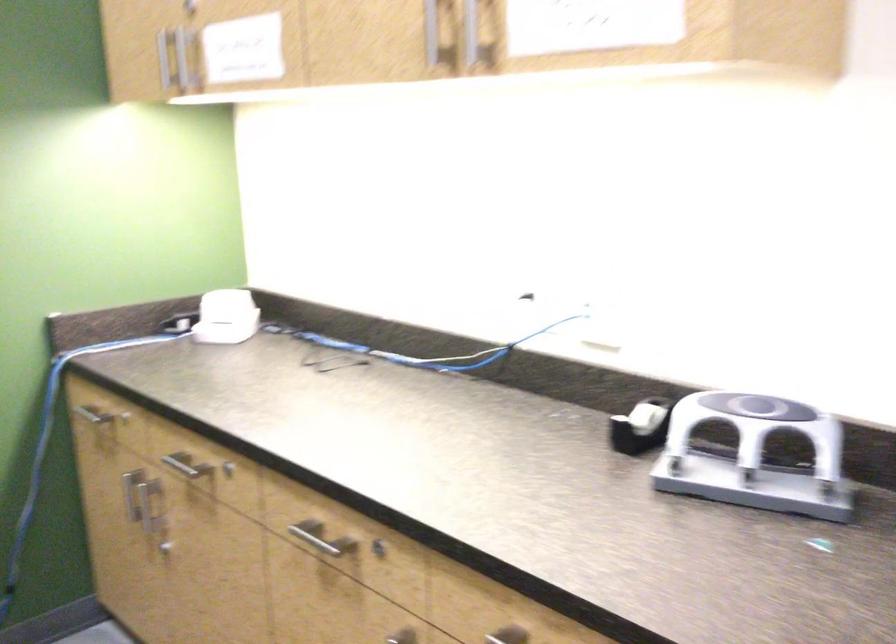
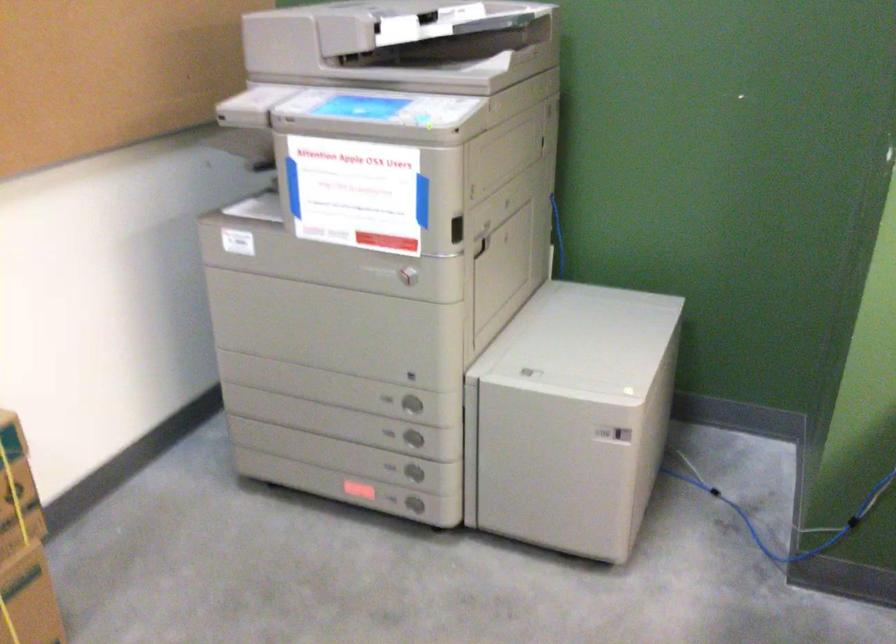
Looking at this image, the images are taken continuously from a first-person perspective. In which direction is your viewpoint rotating?

The rotation direction of the camera is left-down.